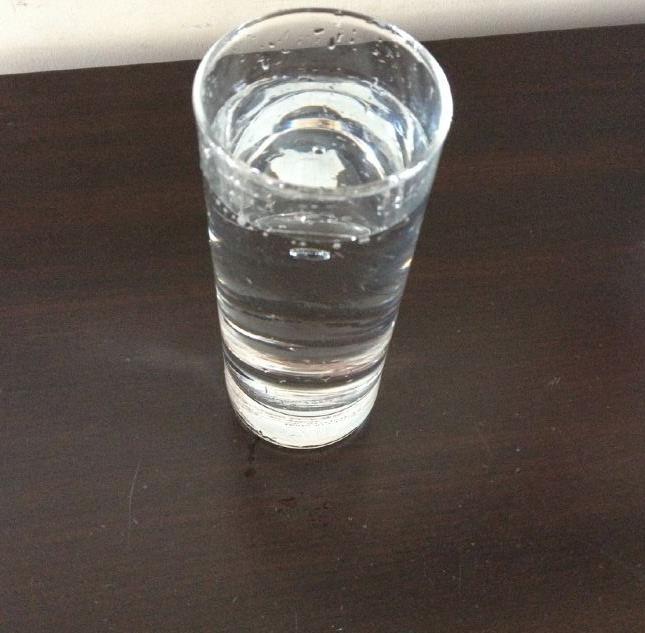
Locate an element on the screen. bottom edge of glass is located at coordinates (310, 452).